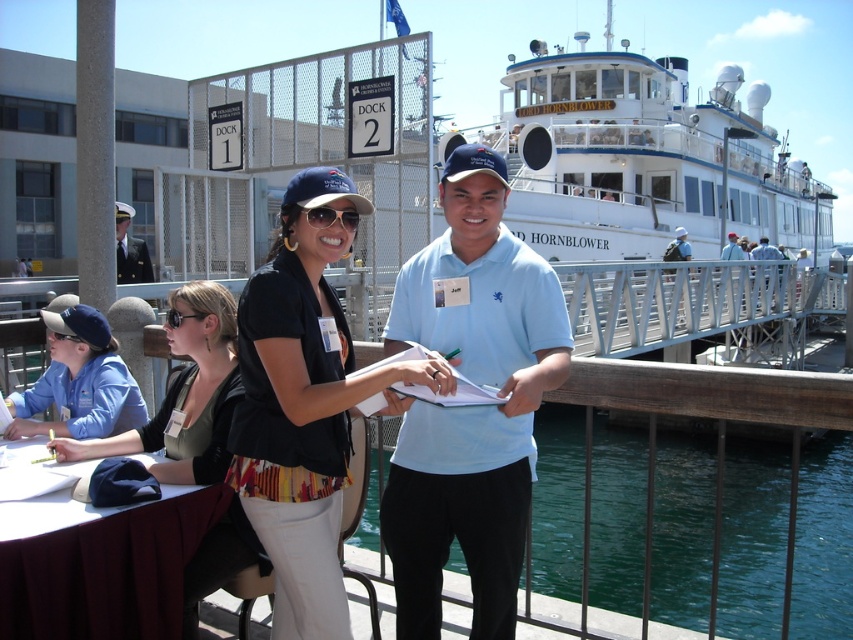
Question: Among these points, which one is nearest to the camera?

Choices:
 (A) (84, 339)
 (B) (335, 212)
 (C) (819, 506)
 (D) (12, 508)

Answer: (D)

Question: Is matte black shirt at center wider than black plastic sunglasses at lower left?

Choices:
 (A) yes
 (B) no

Answer: (A)

Question: Which object appears farthest from the camera in this image?

Choices:
 (A) light blue shirt at right
 (B) dark blue uniform at center

Answer: (A)

Question: Can you confirm if dark blue uniform at center is wider than matte blue shirt at center?

Choices:
 (A) no
 (B) yes

Answer: (B)

Question: Does matte black sunglasses at center appear over black plastic sunglasses at lower left?

Choices:
 (A) no
 (B) yes

Answer: (B)

Question: Which point is farther to the camera?

Choices:
 (A) green liquid water at lower center
 (B) matte blue shirt at center

Answer: (B)